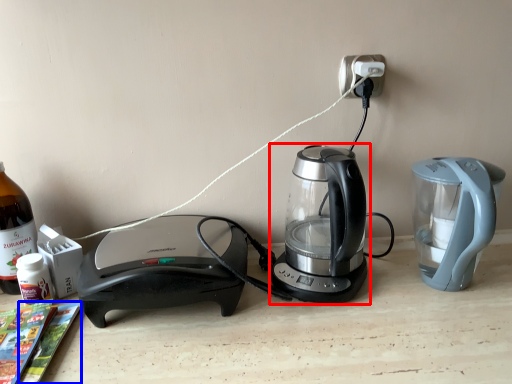
Question: Which object is further to the camera taking this photo, kettle (highlighted by a red box) or magazine (highlighted by a blue box)?

Choices:
 (A) kettle
 (B) magazine

Answer: (A)